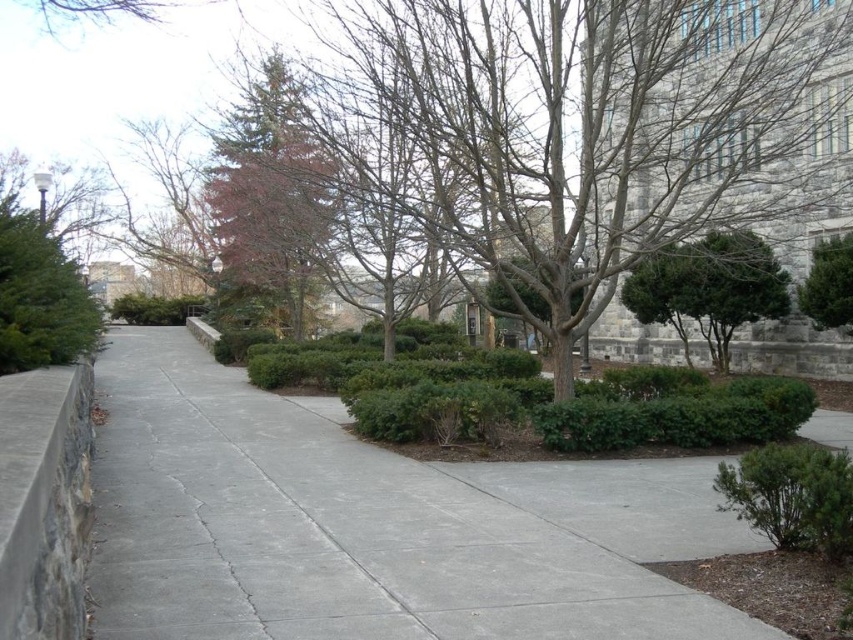
Question: Which point is closer to the camera?

Choices:
 (A) (285, 304)
 (B) (91, 625)
 (C) (746, 483)

Answer: (B)

Question: Is gray concrete pavement at center above green matte tree at upper center?

Choices:
 (A) yes
 (B) no

Answer: (B)

Question: Does gray concrete pavement at center have a greater width compared to green leafy shrub at left?

Choices:
 (A) yes
 (B) no

Answer: (A)

Question: Considering the real-world distances, which object is farthest from the gray concrete pavement at center?

Choices:
 (A) green matte tree at upper center
 (B) green leafy shrub at left
 (C) green leafy bush at right

Answer: (A)

Question: Does green matte shrub at lower right come in front of green leafy bush at right?

Choices:
 (A) no
 (B) yes

Answer: (B)

Question: Estimate the real-world distances between objects in this image. Which object is closer to the green matte shrub at lower right?

Choices:
 (A) green textured shrub at center right
 (B) green leafy shrub at left

Answer: (B)